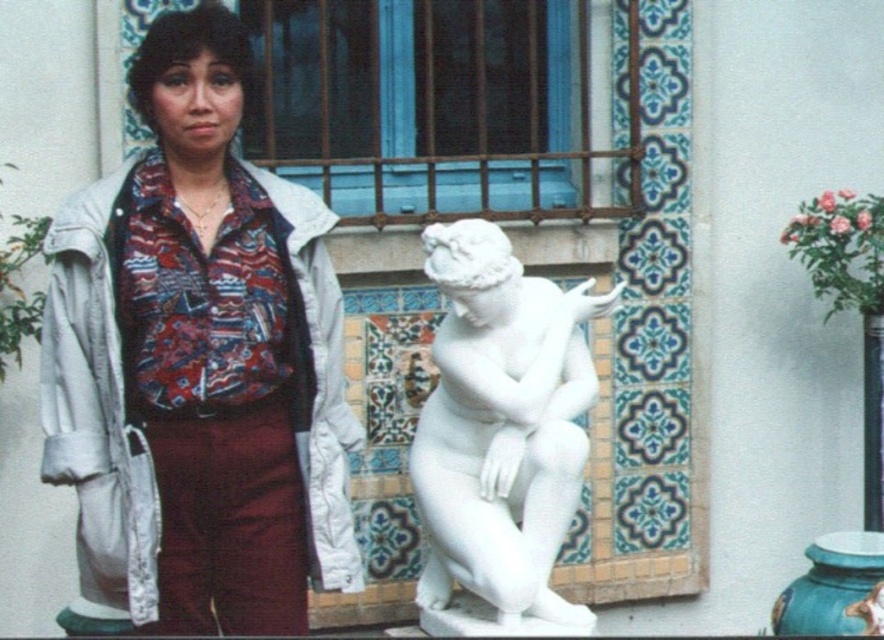
Question: Among these objects, which one is farthest from the camera?

Choices:
 (A) white marble statue at center
 (B) matte white blouse at center

Answer: (A)

Question: Considering the relative positions of matte white blouse at center and white marble statue at center in the image provided, where is matte white blouse at center located with respect to white marble statue at center?

Choices:
 (A) right
 (B) left

Answer: (B)

Question: Can you confirm if matte white blouse at center is positioned to the right of white marble statue at center?

Choices:
 (A) no
 (B) yes

Answer: (A)

Question: Which object appears farthest from the camera in this image?

Choices:
 (A) matte white blouse at center
 (B) white marble statue at center

Answer: (B)

Question: Is matte white blouse at center wider than white marble statue at center?

Choices:
 (A) yes
 (B) no

Answer: (A)